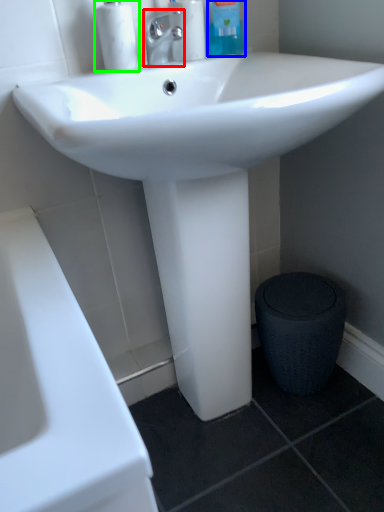
Question: Which object is positioned farthest from tap (highlighted by a red box)? Select from cleaning product (highlighted by a blue box) and soap dispenser (highlighted by a green box).

Choices:
 (A) cleaning product
 (B) soap dispenser

Answer: (A)